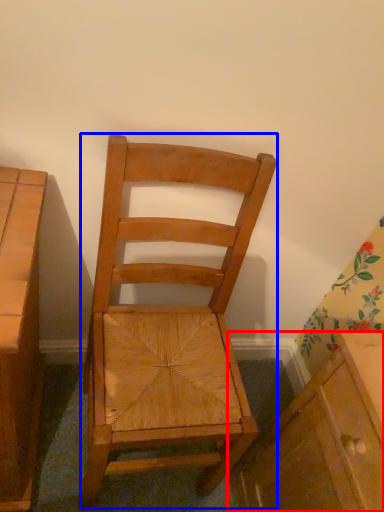
Question: Which point is closer to the camera, cabinetry (highlighted by a red box) or chair (highlighted by a blue box)?

Choices:
 (A) cabinetry
 (B) chair

Answer: (B)